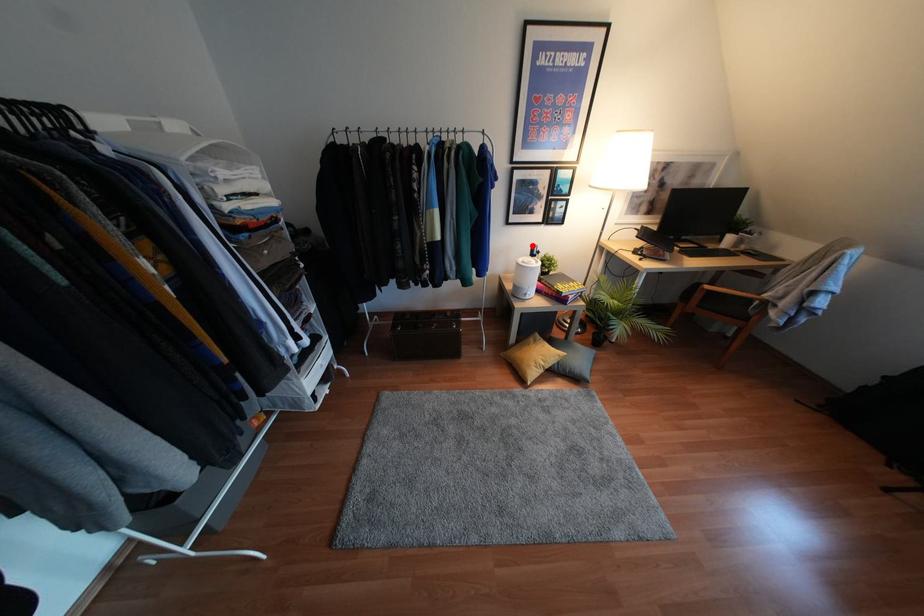
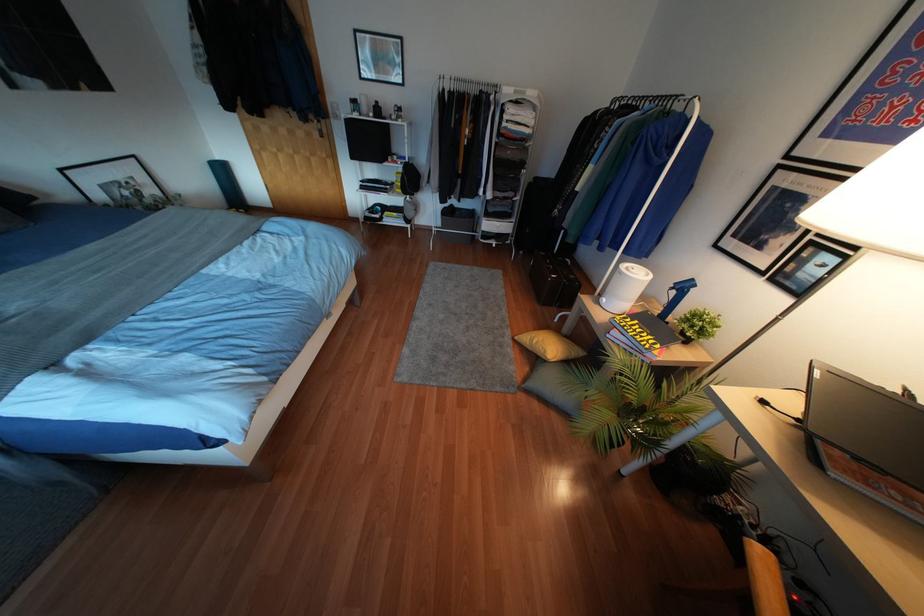
Locate, in the second image, the point that corresponds to the highlighted location in the first image.

(690, 280)